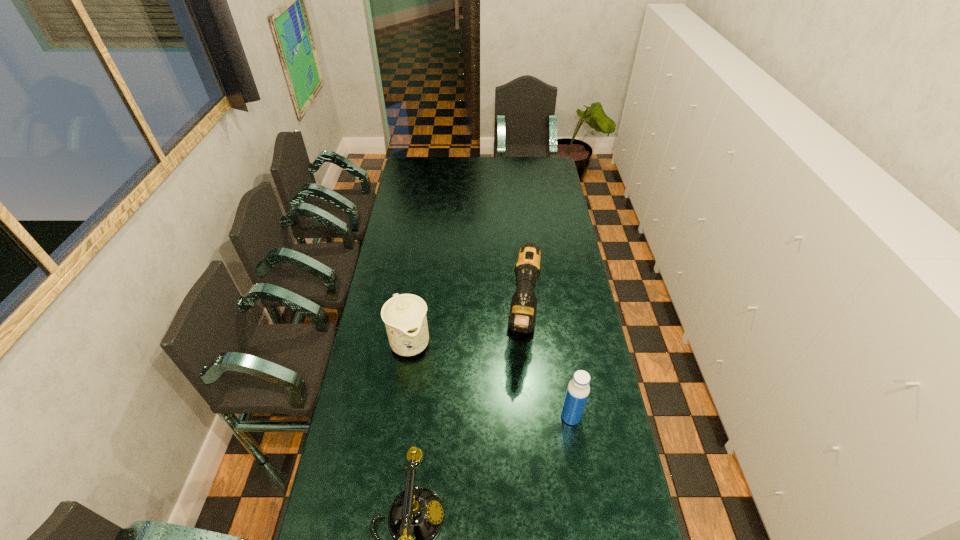
Find the location of `the third farthest object`. the third farthest object is located at coordinates (578, 389).

At what (x,y) coordinates should I click in order to perform the action: click on the rightmost object. Please return your answer as a coordinate pair (x, y). This screenshot has height=540, width=960. Looking at the image, I should click on (578, 389).

Locate an element on the screen. drill is located at coordinates (522, 315).

You are a GUI agent. You are given a task and a screenshot of the screen. Output one action in this format:
    pyautogui.click(x=<x>, y=<y>)
    Task: Click on the tallest object
    The image size is (960, 540).
    Given the screenshot: What is the action you would take?
    pyautogui.click(x=522, y=315)

The image size is (960, 540). Find the location of `chinaware`. chinaware is located at coordinates (x=404, y=315).

Where is `free location located on the left of the water bottle`? This screenshot has height=540, width=960. free location located on the left of the water bottle is located at coordinates (486, 416).

Where is `vacant region located 0.330m at the tip of the drill`? The height and width of the screenshot is (540, 960). vacant region located 0.330m at the tip of the drill is located at coordinates (518, 439).

Identify the location of vacant point located 0.280m at the tip of the drill. Image resolution: width=960 pixels, height=540 pixels. (519, 425).

Locate an element on the screen. The width and height of the screenshot is (960, 540). vacant area situated 0.120m at the tip of the drill is located at coordinates (521, 384).

Locate an element on the screen. Image resolution: width=960 pixels, height=540 pixels. vacant space located 0.090m on the spout of the chinaware is located at coordinates (425, 382).